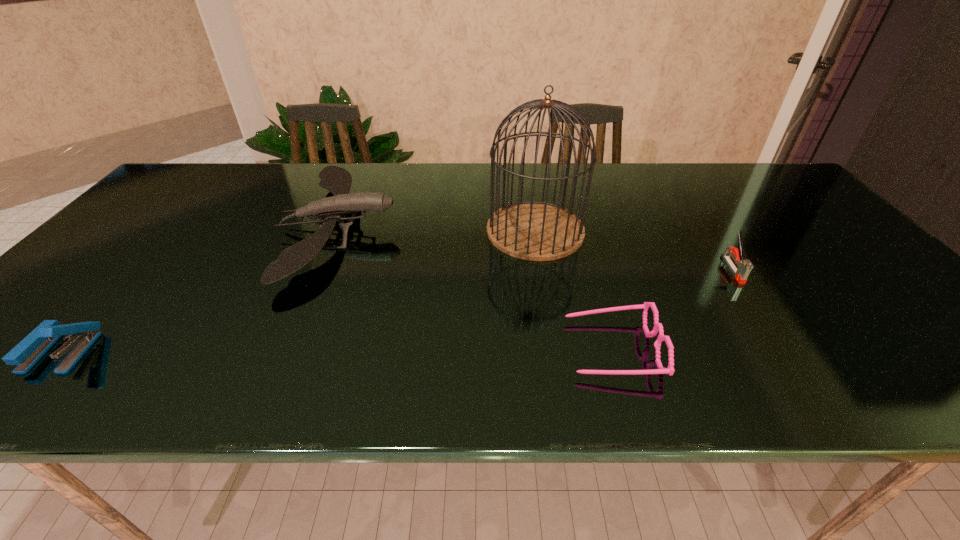
The height and width of the screenshot is (540, 960). I want to click on object positioned at the near left corner, so click(30, 350).

This screenshot has height=540, width=960. I want to click on free space at the far edge, so click(704, 183).

What are the coordinates of `free space at the near edge` in the screenshot? It's located at (686, 394).

Image resolution: width=960 pixels, height=540 pixels. In the image, there is a desktop. Identify the location of free space at the left edge. (98, 300).

I want to click on free space at the right edge of the desktop, so click(869, 326).

At what (x,y) coordinates should I click in order to perform the action: click on vacant space at the far right corner of the desktop. Please return your answer as a coordinate pair (x, y). Looking at the image, I should click on (740, 167).

Locate an element on the screen. Image resolution: width=960 pixels, height=540 pixels. vacant space that's between the farther stapler and the leftmost object is located at coordinates (397, 310).

At what (x,y) coordinates should I click in order to perform the action: click on vacant area between the birdcage and the second object from left to right. Please return your answer as a coordinate pair (x, y). Looking at the image, I should click on (437, 230).

Where is `unoccupied area between the fourth object from right to left and the tallest object`? This screenshot has height=540, width=960. unoccupied area between the fourth object from right to left and the tallest object is located at coordinates (437, 230).

The image size is (960, 540). Find the location of `free spot between the fourth object from right to left and the birdcage`. free spot between the fourth object from right to left and the birdcage is located at coordinates (x=437, y=230).